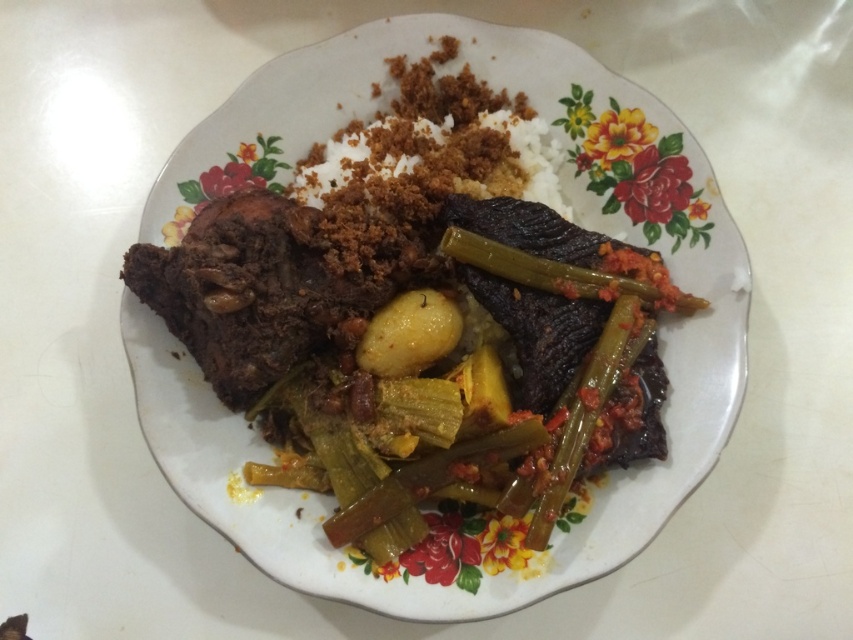
Question: Which object is positioned farthest from the green glossy okra at center?

Choices:
 (A) yellow matte potato at center
 (B) white glossy platter at center

Answer: (A)

Question: Is white glossy platter at center in front of yellow matte potato at center?

Choices:
 (A) yes
 (B) no

Answer: (A)

Question: Is white glossy platter at center below yellow matte potato at center?

Choices:
 (A) yes
 (B) no

Answer: (B)

Question: Among these points, which one is farthest from the camera?

Choices:
 (A) (146, 429)
 (B) (456, 339)
 (C) (561, 397)

Answer: (B)

Question: Which object appears closest to the camera in this image?

Choices:
 (A) white glossy platter at center
 (B) yellow matte potato at center

Answer: (A)

Question: Considering the relative positions of white glossy platter at center and yellow matte potato at center in the image provided, where is white glossy platter at center located with respect to yellow matte potato at center?

Choices:
 (A) left
 (B) right

Answer: (B)